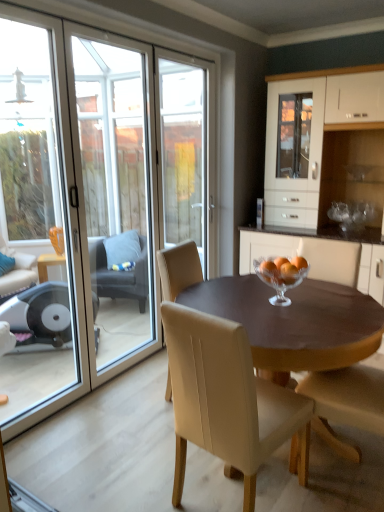
The image size is (384, 512). In order to click on empty space that is ontop of wooden table at center (from a real-world perspective) in this screenshot , I will do `click(268, 300)`.